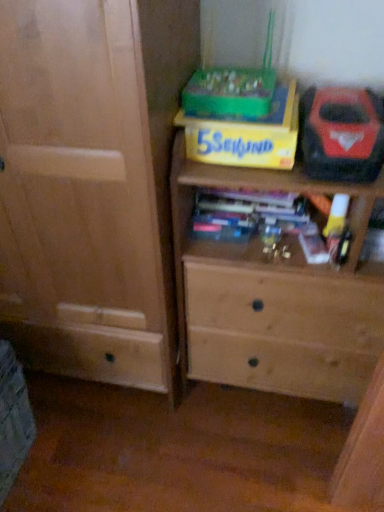
Question: Visually, is light brown wood chest of drawers at center positioned to the left or to the right of yellow cardboard box at upper center?

Choices:
 (A) left
 (B) right

Answer: (B)

Question: Is light brown wood chest of drawers at center wider or thinner than yellow cardboard box at upper center?

Choices:
 (A) thin
 (B) wide

Answer: (B)

Question: Estimate the real-world distances between objects in this image. Which object is farther from the red plastic tool at upper right?

Choices:
 (A) yellow cardboard box at upper center
 (B) light brown wood chest of drawers at center

Answer: (B)

Question: Based on their relative distances, which object is nearer to the red plastic tool at upper right?

Choices:
 (A) yellow cardboard box at upper center
 (B) light brown wood chest of drawers at center

Answer: (A)